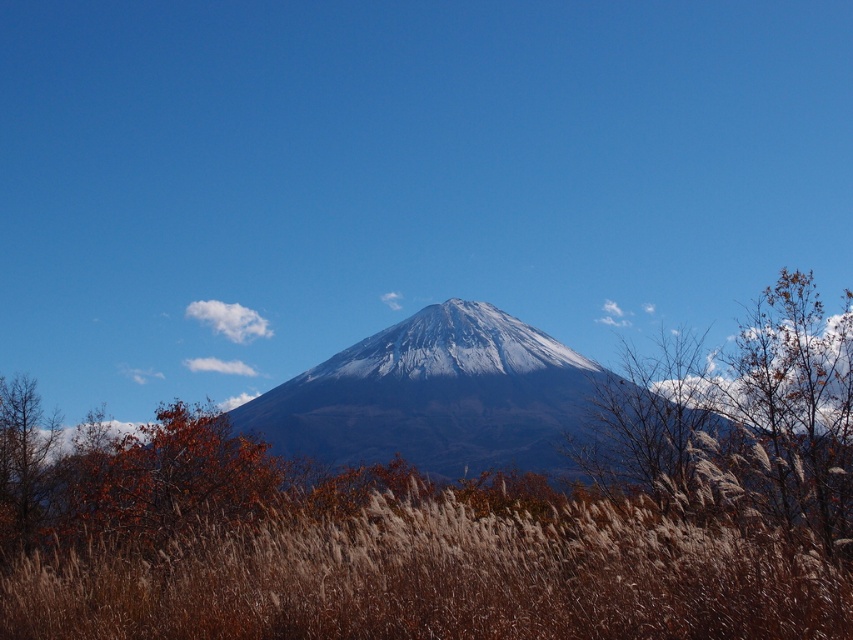
Question: Can you confirm if brown grass at center is wider than brown textured tree at right?

Choices:
 (A) no
 (B) yes

Answer: (B)

Question: Among these points, which one is nearest to the camera?

Choices:
 (A) (61, 502)
 (B) (784, 406)
 (C) (553, 524)
 (D) (462, 316)

Answer: (C)

Question: From the image, what is the correct spatial relationship of brown grass at center in relation to white snow-covered peak at center?

Choices:
 (A) below
 (B) above

Answer: (A)

Question: Which object is positioned farthest from the brown textured tree at right?

Choices:
 (A) brown matte tree at center
 (B) white snow-covered peak at center

Answer: (B)

Question: Is snowy gray mountain at center above brown matte tree at center?

Choices:
 (A) yes
 (B) no

Answer: (A)

Question: Among these objects, which one is nearest to the camera?

Choices:
 (A) brown textured tree at right
 (B) white snow-covered peak at center
 (C) brown matte tree at center
 (D) snowy gray mountain at center

Answer: (A)